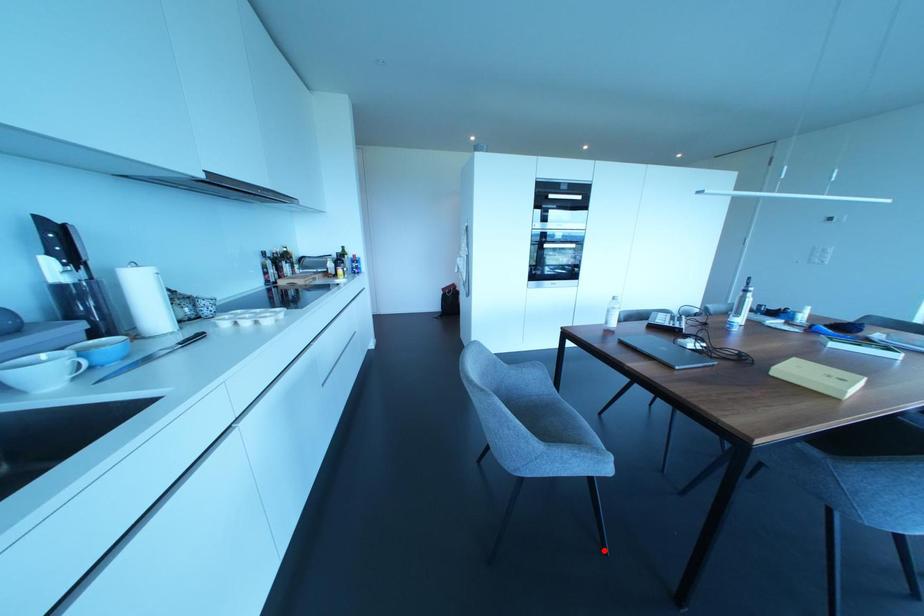
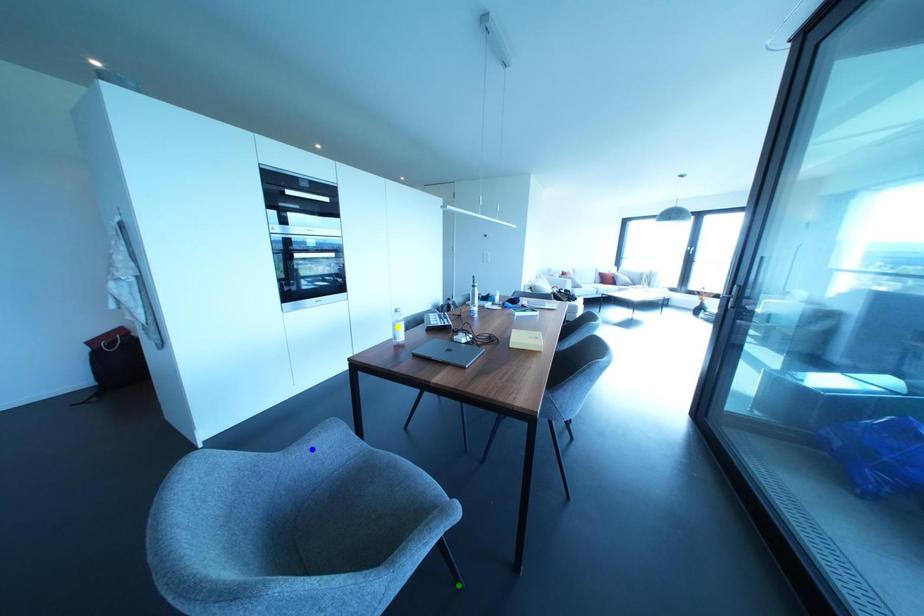
Question: I am providing you with two images of the same scene from different viewpoints. A red point is marked on the first image. You are given multiple points on the second image. Which spot in image 2 lines up with the point in image 1?

Choices:
 (A) blue point
 (B) yellow point
 (C) green point

Answer: (C)